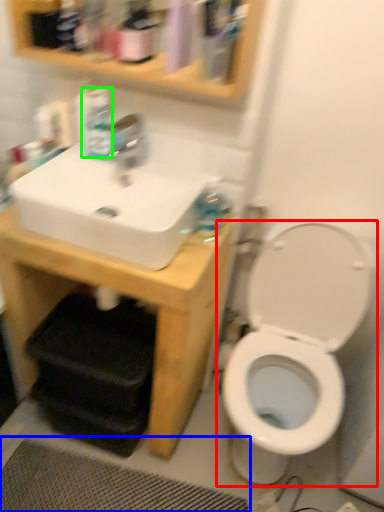
Question: Which is farther away from toilet (highlighted by a red box)? bath mat (highlighted by a blue box) or bottle (highlighted by a green box)?

Choices:
 (A) bath mat
 (B) bottle

Answer: (B)